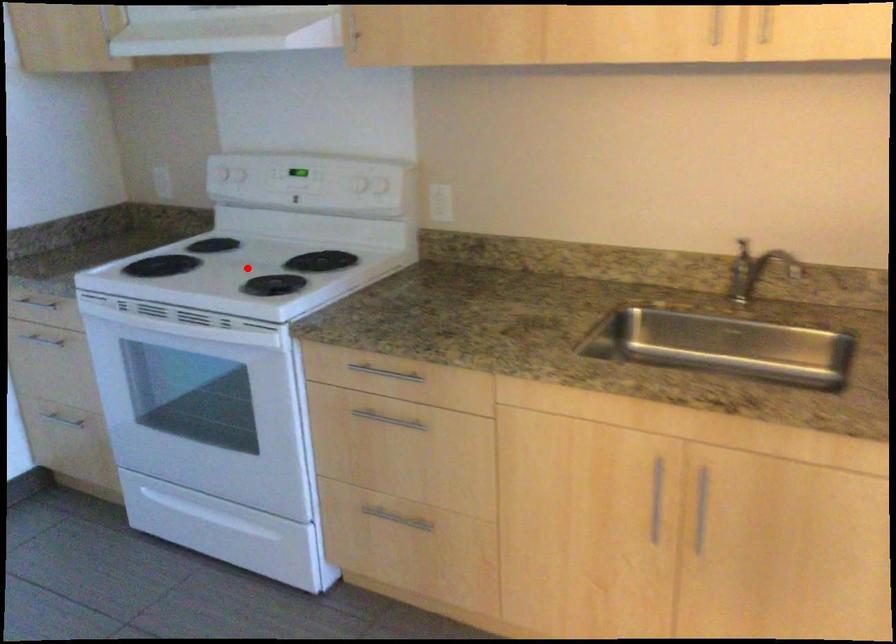
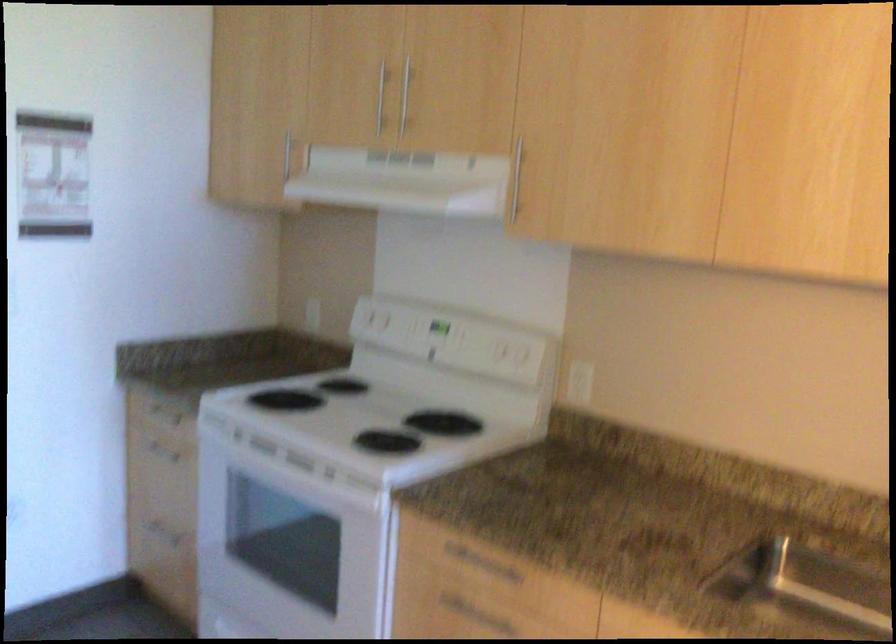
Locate, in the second image, the point that corresponds to the highlighted location in the first image.

(367, 415)